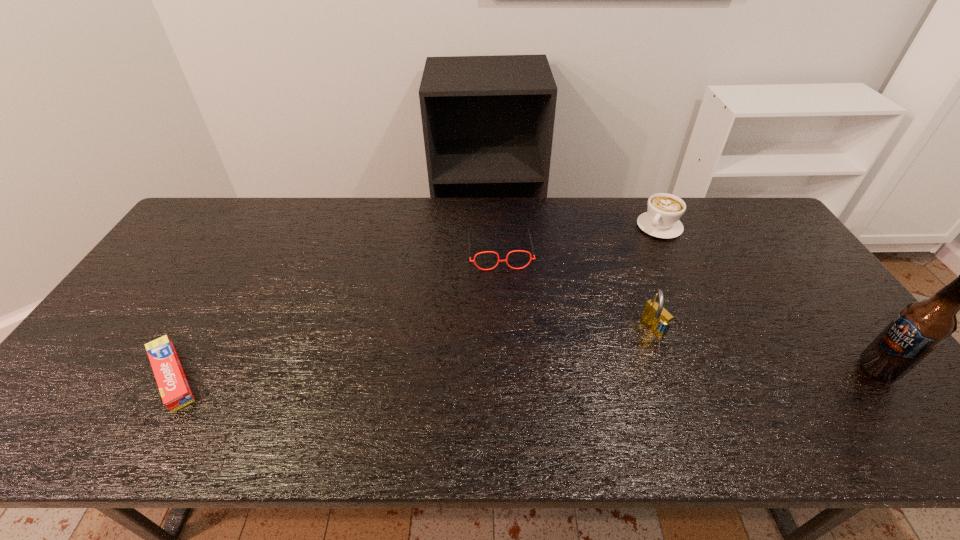
Locate an element on the screen. The image size is (960, 540). toothpaste is located at coordinates (175, 391).

At what (x,y) coordinates should I click in order to perform the action: click on the leftmost object. Please return your answer as a coordinate pair (x, y). This screenshot has height=540, width=960. Looking at the image, I should click on (175, 391).

Find the location of a particular element. This screenshot has height=540, width=960. beer bottle is located at coordinates [920, 327].

You are a GUI agent. You are given a task and a screenshot of the screen. Output one action in this format:
    pyautogui.click(x=<x>, y=<y>)
    Task: Click on the tallest object
    
    Given the screenshot: What is the action you would take?
    pyautogui.click(x=920, y=327)

Where is `the third farthest object`? the third farthest object is located at coordinates (654, 315).

The height and width of the screenshot is (540, 960). What are the coordinates of `the third object from right to left` in the screenshot? It's located at (654, 315).

Image resolution: width=960 pixels, height=540 pixels. In order to click on the second object from left to right in this screenshot , I will do `click(531, 258)`.

At what (x,y) coordinates should I click in order to perform the action: click on the second shortest object. Please return your answer as a coordinate pair (x, y). Image resolution: width=960 pixels, height=540 pixels. Looking at the image, I should click on (531, 258).

The height and width of the screenshot is (540, 960). I want to click on the third tallest object, so click(661, 220).

This screenshot has height=540, width=960. I want to click on cappuccino, so click(661, 220).